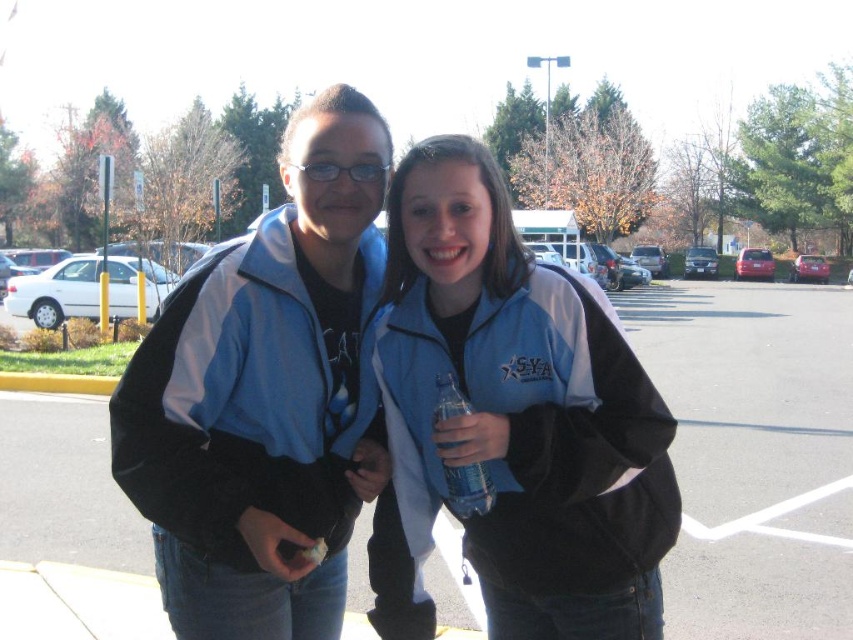
Question: Which object is farther from the camera taking this photo?

Choices:
 (A) matte blue jacket at center
 (B) blue fleece jacket at center
 (C) clear plastic water bottle at center

Answer: (A)

Question: Does blue fleece jacket at center come in front of matte blue jacket at center?

Choices:
 (A) no
 (B) yes

Answer: (B)

Question: Is blue fleece jacket at center to the left of matte blue jacket at center from the viewer's perspective?

Choices:
 (A) yes
 (B) no

Answer: (A)

Question: Among these points, which one is nearest to the camera?

Choices:
 (A) (88, 481)
 (B) (486, 476)
 (C) (460, 435)

Answer: (C)

Question: Which object appears farthest from the camera in this image?

Choices:
 (A) clear plastic water bottle at center
 (B) matte blue jacket at center

Answer: (B)

Question: Does blue fleece jacket at center appear under clear plastic water bottle at center?

Choices:
 (A) yes
 (B) no

Answer: (B)